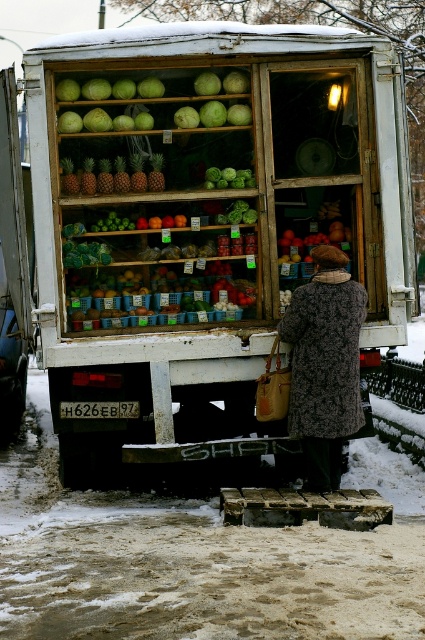
Is white matte food truck at center further to camera compared to fluffy brown coat at center?

No, white matte food truck at center is in front of fluffy brown coat at center.

Between white matte food truck at center and fluffy brown coat at center, which one is positioned lower?

Positioned lower is fluffy brown coat at center.

Between point (402, 148) and point (333, 340), which one is positioned behind?

Positioned behind is point (402, 148).

Find the location of a particular element. white matte food truck at center is located at coordinates (204, 224).

Describe the element at coordinates (204, 224) in the screenshot. This screenshot has height=640, width=425. I see `white matte food truck at center` at that location.

Does white matte food truck at center have a greater width compared to pineapple matte at center?

Indeed, white matte food truck at center has a greater width compared to pineapple matte at center.

Who is more distant from viewer, (91, 141) or (98, 186)?

The point (91, 141) is more distant.

Identify the location of white matte food truck at center. The image size is (425, 640). (204, 224).

Is point (263, 157) positioned after point (331, 236)?

That is False.

Does white matte food truck at center lie behind shiny red apples at center?

No, white matte food truck at center is in front of shiny red apples at center.

Where is `white matte food truck at center`? This screenshot has width=425, height=640. white matte food truck at center is located at coordinates (204, 224).